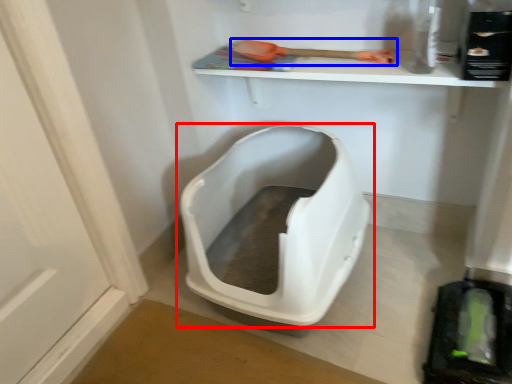
Question: Which of the following is the farthest to the observer, toilet (highlighted by a red box) or tool (highlighted by a blue box)?

Choices:
 (A) toilet
 (B) tool

Answer: (B)